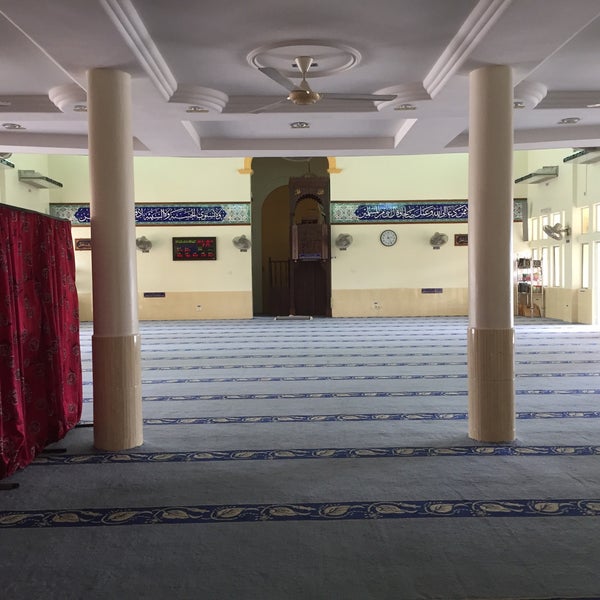
The height and width of the screenshot is (600, 600). I want to click on curtain, so click(45, 333).